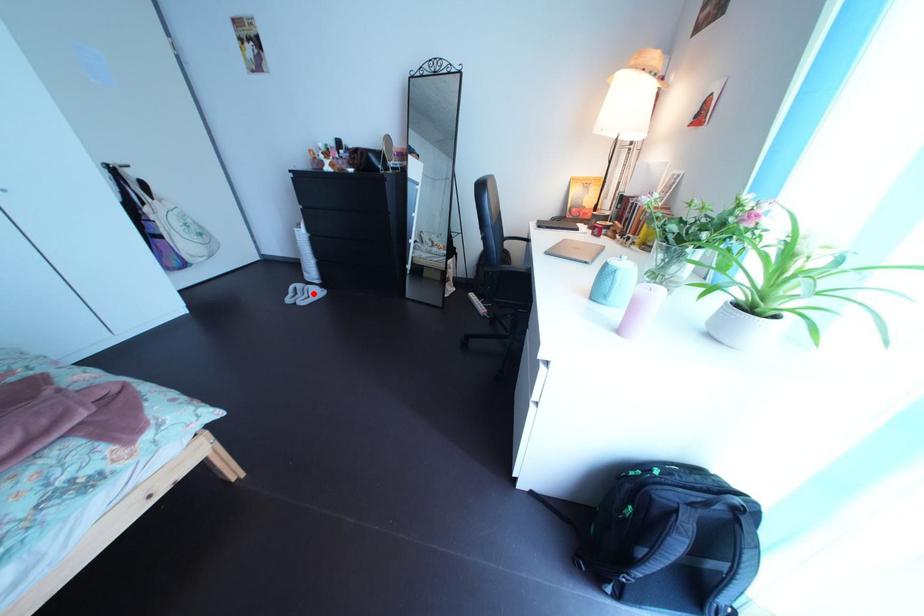
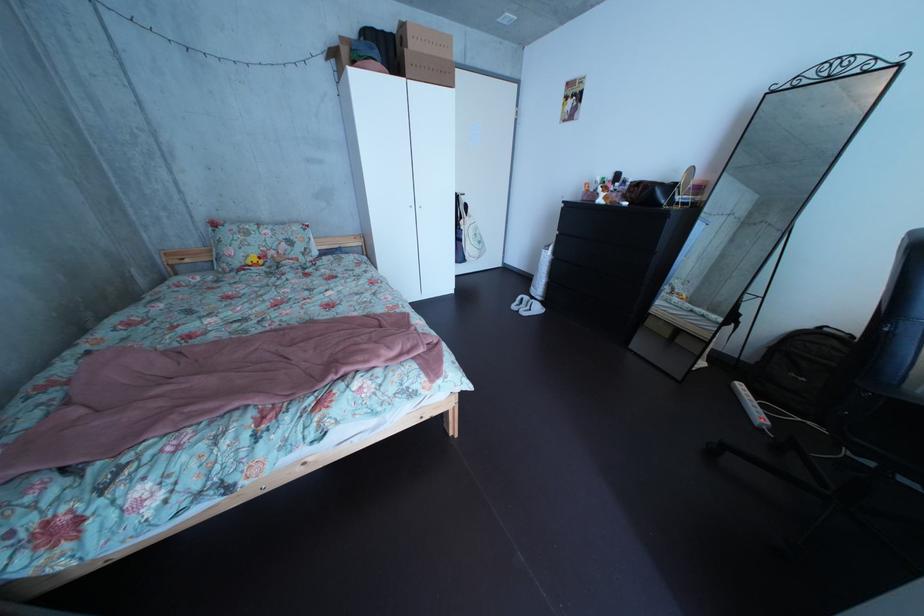
Question: I am providing you with two images of the same scene from different viewpoints. A red point is marked on the first image. At the location where the point appears in image 1, is it still visible in image 2?

Choices:
 (A) Yes
 (B) No

Answer: (A)